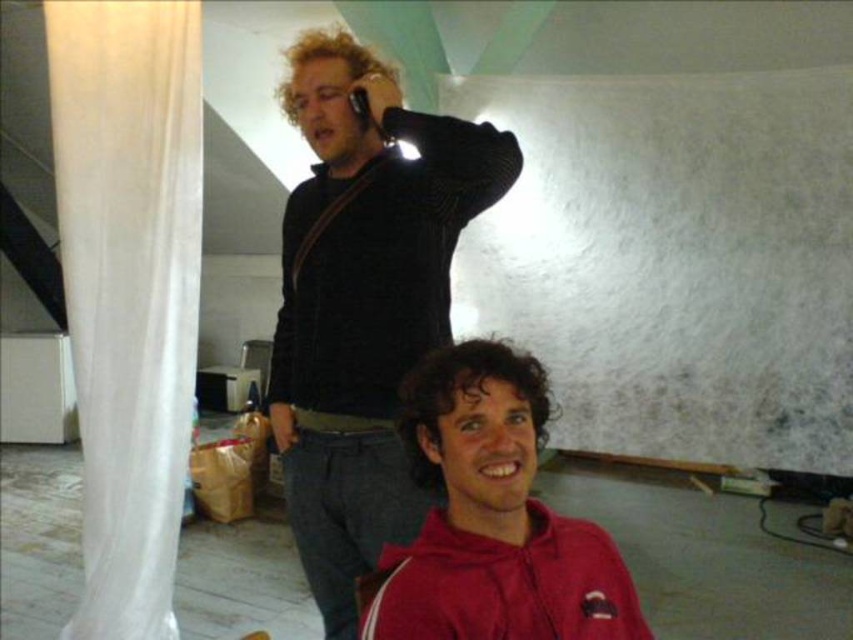
Find the location of a particular element. white sheer curtain at left is located at coordinates (129, 289).

Describe the element at coordinates (129, 289) in the screenshot. I see `white sheer curtain at left` at that location.

Identify the location of white sheer curtain at left. (129, 289).

In the scene shown: Is black sweater at upper center to the right of red matte jacket at center from the viewer's perspective?

No, black sweater at upper center is not to the right of red matte jacket at center.

At what (x,y) coordinates should I click in order to perform the action: click on black sweater at upper center. Please return your answer as a coordinate pair (x, y). The height and width of the screenshot is (640, 853). Looking at the image, I should click on (363, 301).

In order to click on black sweater at upper center in this screenshot , I will do `click(363, 301)`.

Does black sweater at upper center appear on the right side of white sheer curtain at left?

Indeed, black sweater at upper center is positioned on the right side of white sheer curtain at left.

I want to click on black sweater at upper center, so click(363, 301).

The height and width of the screenshot is (640, 853). What are the coordinates of `black sweater at upper center` in the screenshot? It's located at (363, 301).

The width and height of the screenshot is (853, 640). Find the location of `black sweater at upper center`. black sweater at upper center is located at coordinates (363, 301).